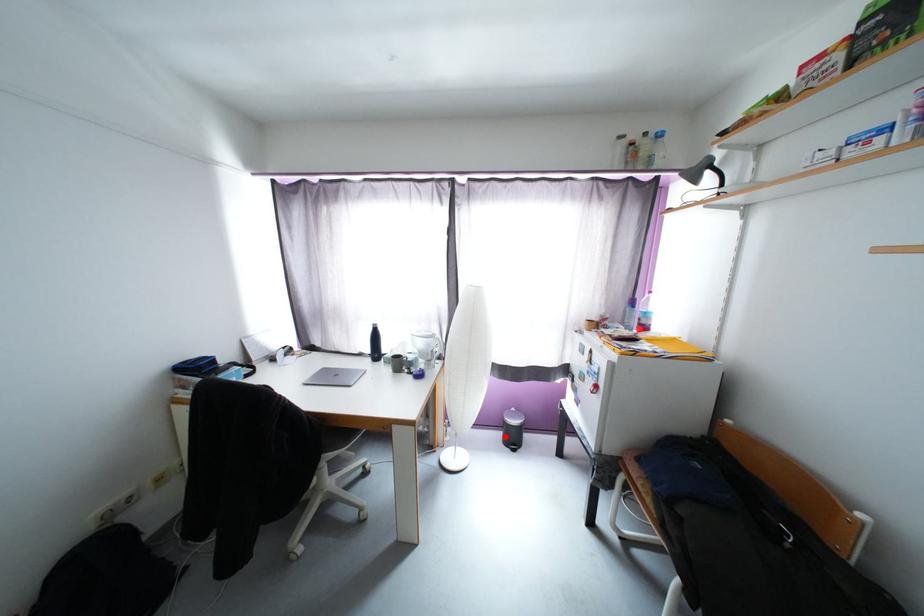
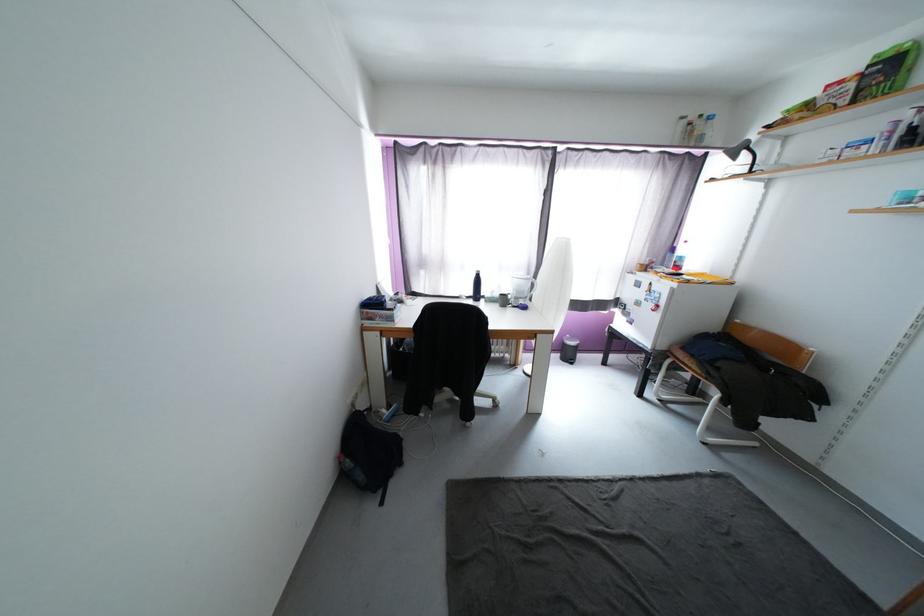
The point at the highlighted location is marked in the first image. Where is the corresponding point in the second image?

(564, 357)